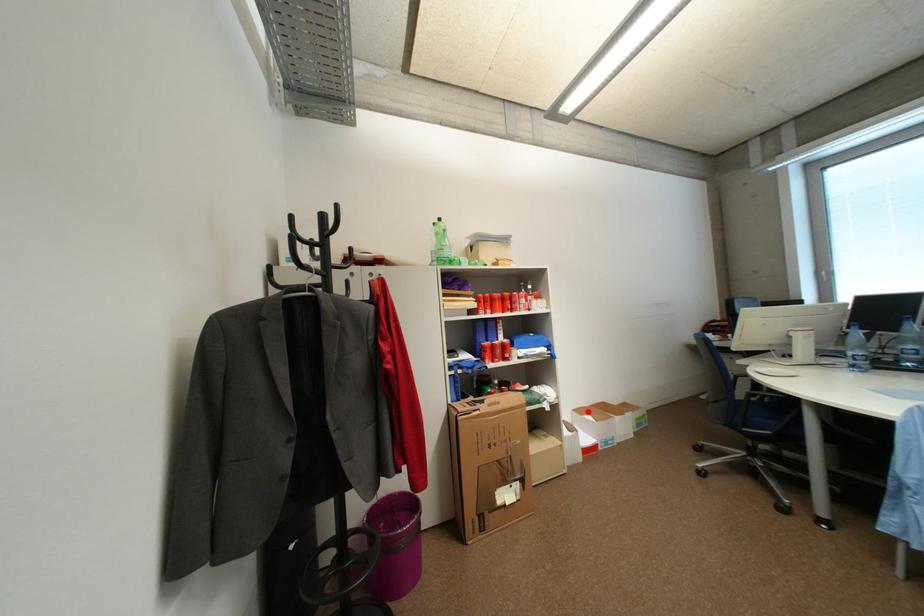
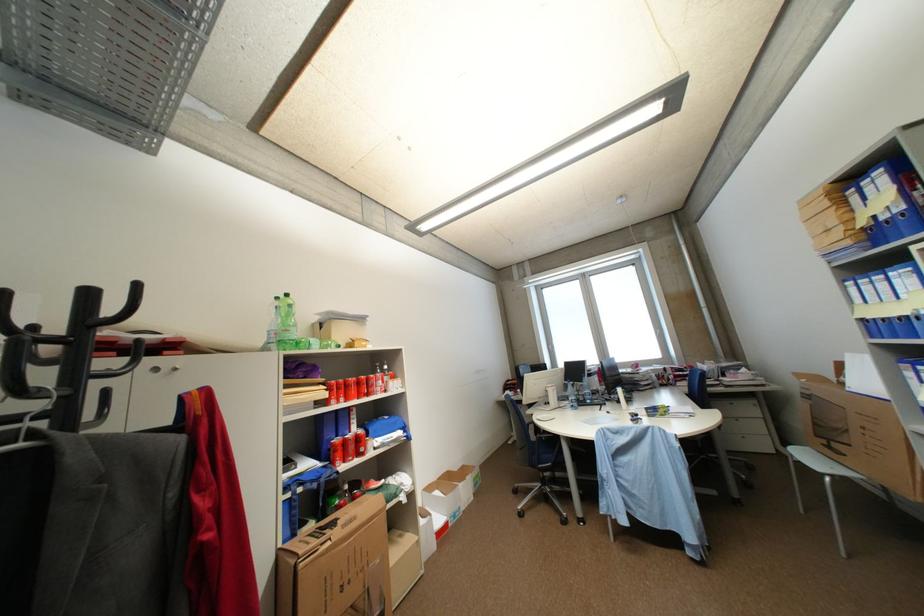
Locate, in the second image, the point that corresponds to the highlighted location in the first image.

(438, 490)